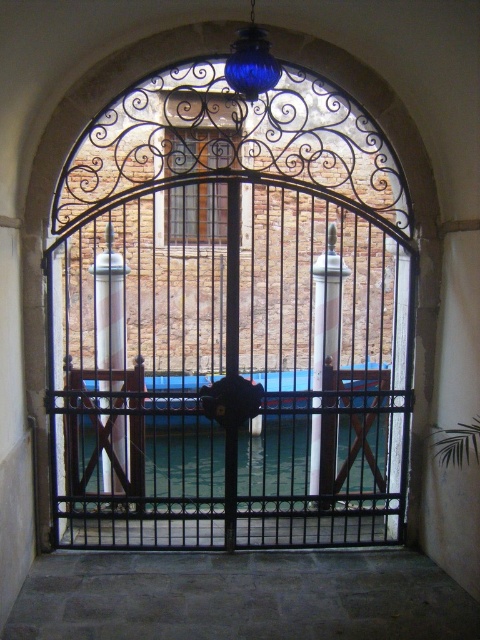
Question: Which point is farther to the camera?

Choices:
 (A) black metal gate at center
 (B) clear glass water at center

Answer: (A)

Question: Is black metal gate at center thinner than clear glass water at center?

Choices:
 (A) no
 (B) yes

Answer: (B)

Question: Can you confirm if black metal gate at center is positioned to the right of clear glass water at center?

Choices:
 (A) yes
 (B) no

Answer: (A)

Question: From the image, what is the correct spatial relationship of black metal gate at center in relation to clear glass water at center?

Choices:
 (A) below
 (B) above

Answer: (B)

Question: Among these points, which one is nearest to the camera?

Choices:
 (A) (178, 433)
 (B) (300, 337)

Answer: (A)

Question: Which point is farther to the camera?

Choices:
 (A) (147, 92)
 (B) (302, 490)

Answer: (B)